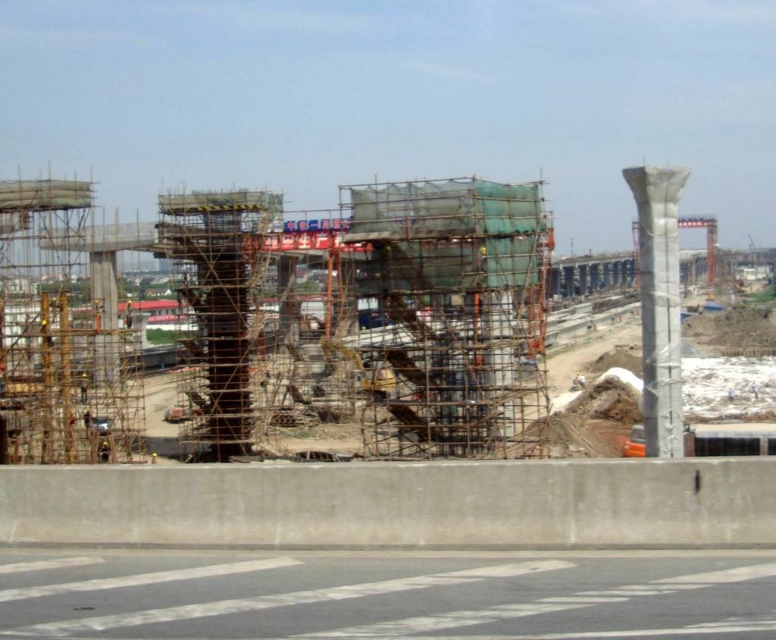
Does white concrete pillar at right have a lesser height compared to gray metallic crane at center?

Yes, white concrete pillar at right is shorter than gray metallic crane at center.

This screenshot has width=776, height=640. What are the coordinates of `white concrete pillar at right` in the screenshot? It's located at (660, 304).